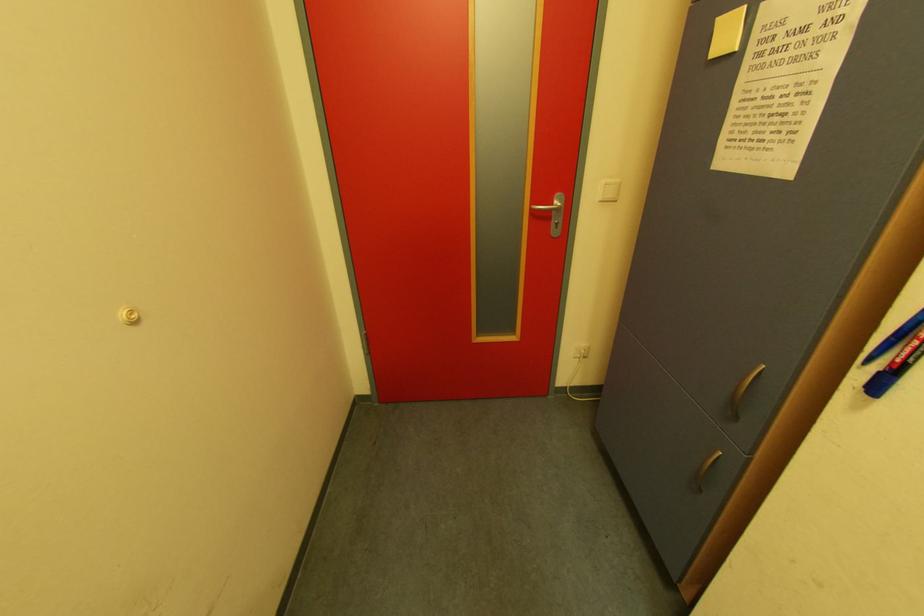
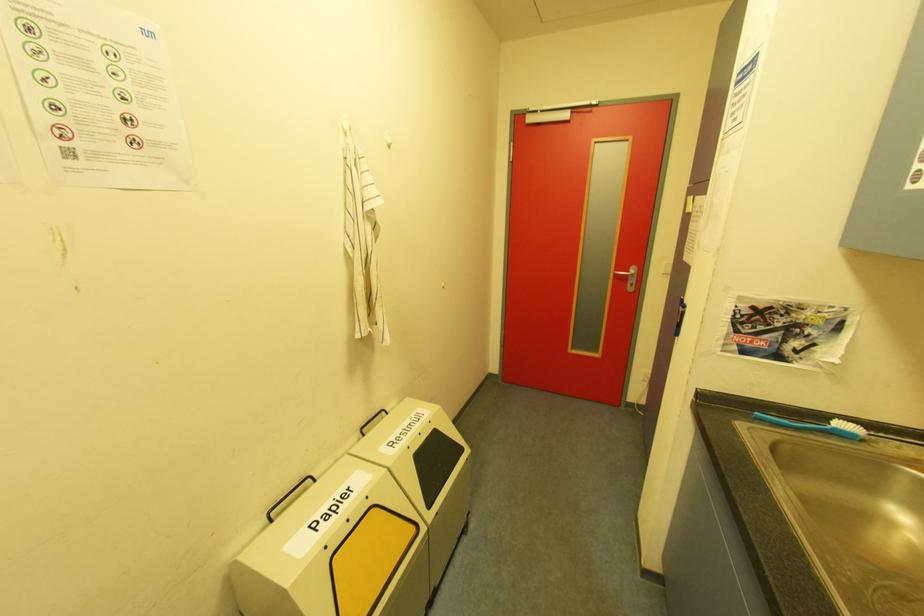
Question: Which direction would the cameraman need to move to produce the second image? Reply with the corresponding letter.

Choices:
 (A) Left
 (B) Right
 (C) Forward
 (D) Backward

Answer: (D)